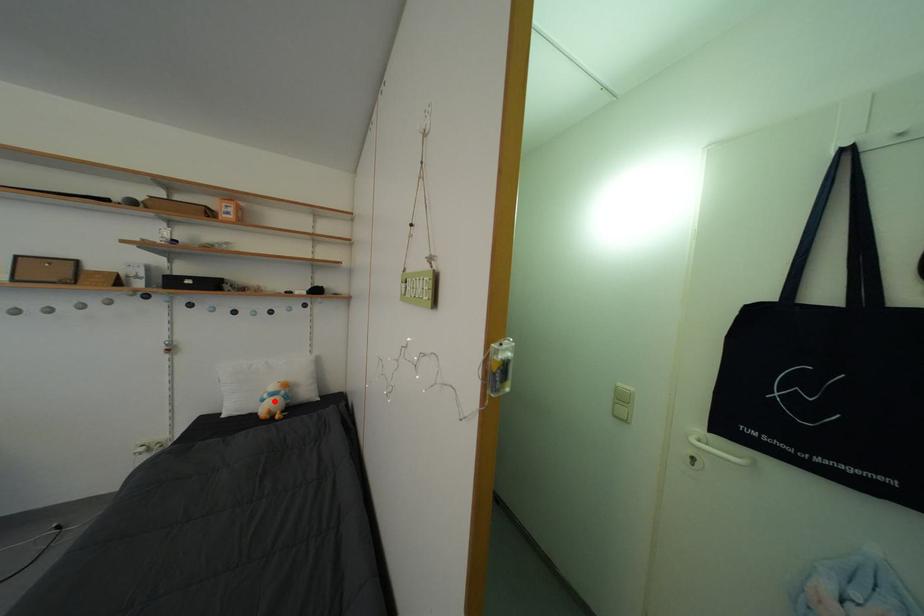
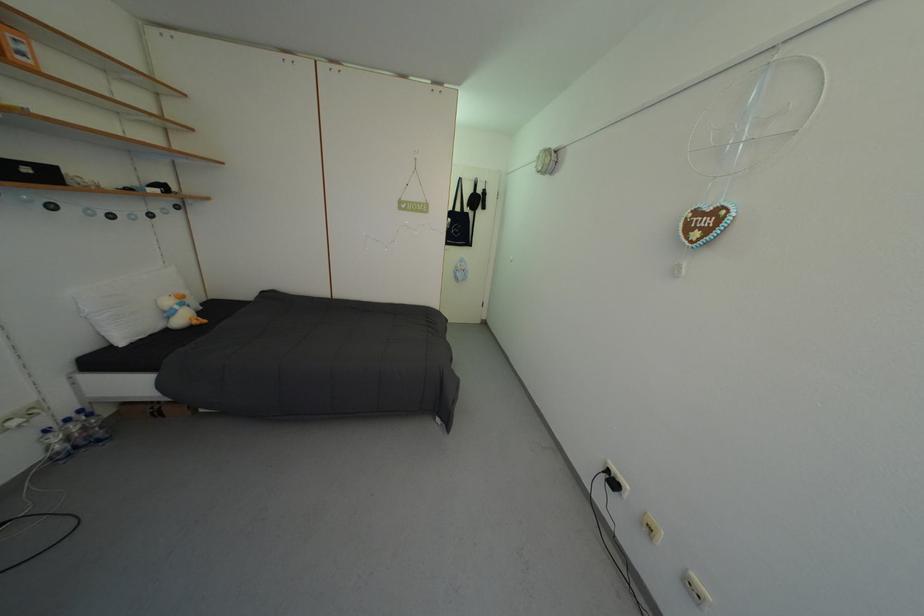
The point at the highlighted location is marked in the first image. Where is the corresponding point in the second image?

(186, 313)